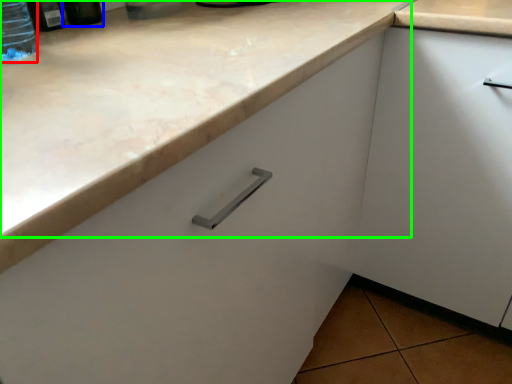
Question: Based on their relative distances, which object is farther from bottle (highlighted by a red box)? Choose from bottle (highlighted by a blue box) and counter top (highlighted by a green box).

Choices:
 (A) bottle
 (B) counter top

Answer: (B)